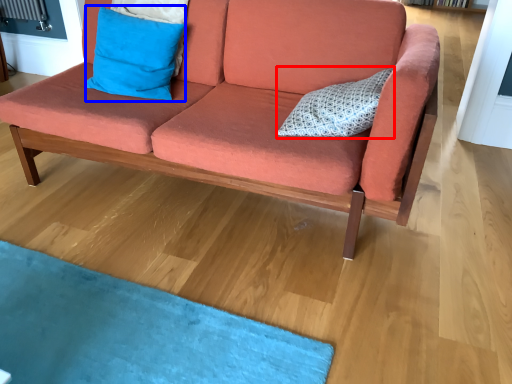
Question: Which object is further to the camera taking this photo, pillow (highlighted by a red box) or pillow (highlighted by a blue box)?

Choices:
 (A) pillow
 (B) pillow

Answer: (B)